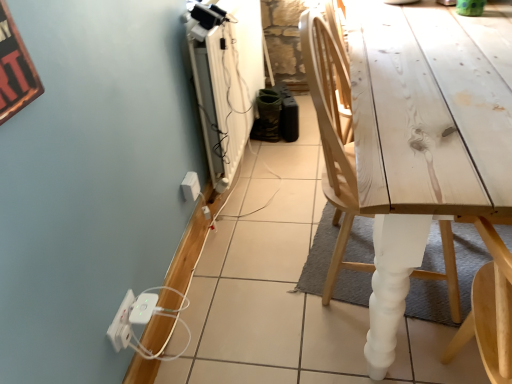
Question: Is white plastic extension cord at lower left surrounding white plastic power strip at lower left, acting as the 1th electric outlet starting from the left?

Choices:
 (A) no
 (B) yes

Answer: (A)

Question: Considering the relative positions of white plastic extension cord at lower left and white plastic power strip at lower left, which is counted as the 1th electric outlet, starting from the bottom, in the image provided, is white plastic extension cord at lower left to the right of white plastic power strip at lower left, which is counted as the 1th electric outlet, starting from the bottom, from the viewer's perspective?

Choices:
 (A) no
 (B) yes

Answer: (B)

Question: Are white plastic extension cord at lower left and white plastic power strip at lower left, which ranks as the 2th electric outlet in right-to-left order, located far from each other?

Choices:
 (A) yes
 (B) no

Answer: (B)

Question: Does white plastic extension cord at lower left have a greater height compared to white plastic power strip at lower left, marked as the second electric outlet in a top-to-bottom arrangement?

Choices:
 (A) no
 (B) yes

Answer: (A)

Question: From the image's perspective, does white plastic extension cord at lower left appear lower than white plastic power strip at lower left, acting as the 1th electric outlet starting from the front?

Choices:
 (A) yes
 (B) no

Answer: (B)

Question: In the image, is natural wood chair at right on the left side or the right side of white plastic electric outlet at lower left, which is counted as the 1th electric outlet, starting from the back?

Choices:
 (A) left
 (B) right

Answer: (B)

Question: From the image's perspective, is natural wood chair at right above or below white plastic electric outlet at lower left, positioned as the first electric outlet in right-to-left order?

Choices:
 (A) below
 (B) above

Answer: (B)

Question: Considering the positions of point (334, 225) and point (192, 193), is point (334, 225) closer or farther from the camera than point (192, 193)?

Choices:
 (A) closer
 (B) farther

Answer: (B)

Question: Is natural wood chair at right wider or thinner than white plastic electric outlet at lower left, acting as the second electric outlet starting from the front?

Choices:
 (A) wide
 (B) thin

Answer: (A)

Question: Would you say white plastic extension cord at lower left is to the left or to the right of white plastic electric outlet at lower left, acting as the second electric outlet starting from the front, in the picture?

Choices:
 (A) right
 (B) left

Answer: (B)

Question: From a real-world perspective, is white plastic extension cord at lower left physically located above or below white plastic electric outlet at lower left, which is the first electric outlet from top to bottom?

Choices:
 (A) below
 (B) above

Answer: (A)

Question: Is white plastic extension cord at lower left in front of or behind white plastic electric outlet at lower left, which is counted as the 1th electric outlet, starting from the back, in the image?

Choices:
 (A) front
 (B) behind

Answer: (A)

Question: Which is correct: white plastic extension cord at lower left is inside white plastic electric outlet at lower left, positioned as the first electric outlet in right-to-left order, or outside of it?

Choices:
 (A) outside
 (B) inside

Answer: (A)

Question: Would you say white plastic electric outlet at lower left, acting as the second electric outlet starting from the front, is to the left or to the right of white plastic power strip at lower left, acting as the 1th electric outlet starting from the front, in the picture?

Choices:
 (A) left
 (B) right

Answer: (B)

Question: From the image's perspective, is white plastic electric outlet at lower left, acting as the second electric outlet starting from the front, located above or below white plastic power strip at lower left, marked as the second electric outlet in a top-to-bottom arrangement?

Choices:
 (A) below
 (B) above

Answer: (B)